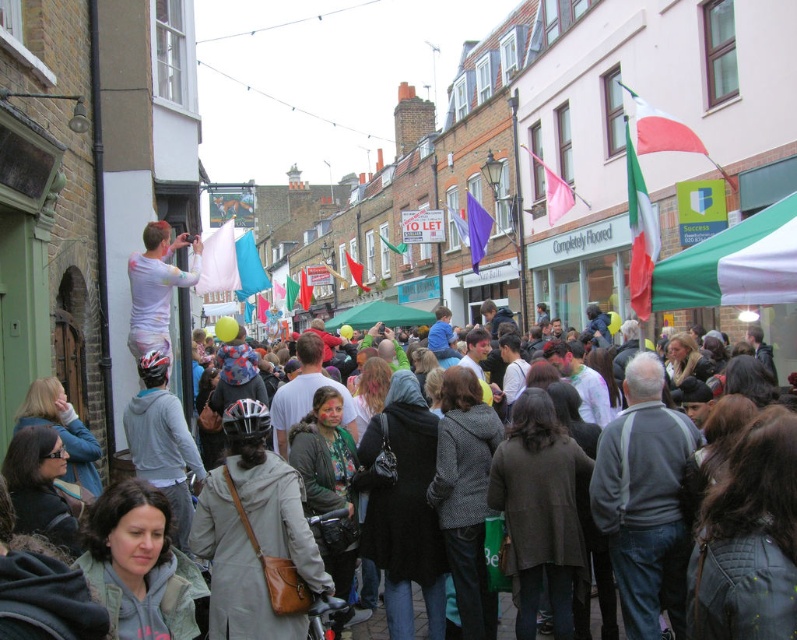
Question: Which object appears farthest from the camera in this image?

Choices:
 (A) multicolored fabric at center
 (B) green/white fabric canopy at center-right

Answer: (A)

Question: Is green/white fabric canopy at center-right further to the viewer compared to multicolored fabric at center?

Choices:
 (A) no
 (B) yes

Answer: (A)

Question: Which object is closer to the camera taking this photo?

Choices:
 (A) green/white fabric canopy at center-right
 (B) multicolored fabric at center

Answer: (A)

Question: Which point is closer to the camera?

Choices:
 (A) green/white fabric canopy at center-right
 (B) multicolored fabric at center

Answer: (A)

Question: Is green/white fabric canopy at center-right below multicolored fabric at center?

Choices:
 (A) no
 (B) yes

Answer: (A)

Question: Can you confirm if green/white fabric canopy at center-right is thinner than multicolored fabric at center?

Choices:
 (A) yes
 (B) no

Answer: (A)